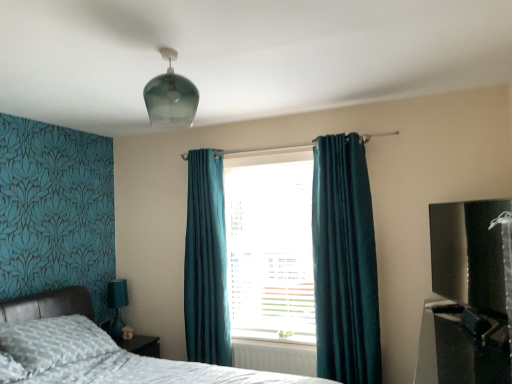
Question: From a real-world perspective, does white plastic radiator at lower center stand above teal velvet curtain at center, the second curtain positioned from the back?

Choices:
 (A) no
 (B) yes

Answer: (A)

Question: Is teal velvet curtain at center, the second curtain positioned from the back, at the back of white plastic radiator at lower center?

Choices:
 (A) no
 (B) yes

Answer: (A)

Question: Considering the relative sizes of white plastic radiator at lower center and teal velvet curtain at center, the 1th curtain positioned from the right, in the image provided, is white plastic radiator at lower center shorter than teal velvet curtain at center, the 1th curtain positioned from the right,?

Choices:
 (A) yes
 (B) no

Answer: (A)

Question: Considering the relative positions of white plastic radiator at lower center and teal velvet curtain at center, the 1th curtain positioned from the right, in the image provided, is white plastic radiator at lower center to the right of teal velvet curtain at center, the 1th curtain positioned from the right, from the viewer's perspective?

Choices:
 (A) yes
 (B) no

Answer: (B)

Question: From a real-world perspective, is white plastic radiator at lower center located beneath teal velvet curtain at center, arranged as the first curtain when viewed from the front?

Choices:
 (A) no
 (B) yes

Answer: (B)

Question: Does white plastic radiator at lower center come behind teal velvet curtain at center, the 1th curtain positioned from the right?

Choices:
 (A) yes
 (B) no

Answer: (A)

Question: Considering the relative sizes of white plastic radiator at lower center and transparent glass light fixture at upper center in the image provided, is white plastic radiator at lower center taller than transparent glass light fixture at upper center?

Choices:
 (A) no
 (B) yes

Answer: (A)

Question: Considering the relative positions of white plastic radiator at lower center and transparent glass light fixture at upper center in the image provided, is white plastic radiator at lower center in front of transparent glass light fixture at upper center?

Choices:
 (A) no
 (B) yes

Answer: (A)

Question: Is transparent glass light fixture at upper center completely or partially inside white plastic radiator at lower center?

Choices:
 (A) yes
 (B) no

Answer: (B)

Question: Is white plastic radiator at lower center next to transparent glass light fixture at upper center?

Choices:
 (A) no
 (B) yes

Answer: (A)

Question: Can you confirm if white plastic radiator at lower center is smaller than transparent glass light fixture at upper center?

Choices:
 (A) yes
 (B) no

Answer: (A)

Question: Is white plastic radiator at lower center turned away from transparent glass light fixture at upper center?

Choices:
 (A) no
 (B) yes

Answer: (A)

Question: Can you confirm if black glossy tv at right, which is the first entertainment center from top to bottom, is smaller than patterned fabric bed at lower left?

Choices:
 (A) yes
 (B) no

Answer: (A)